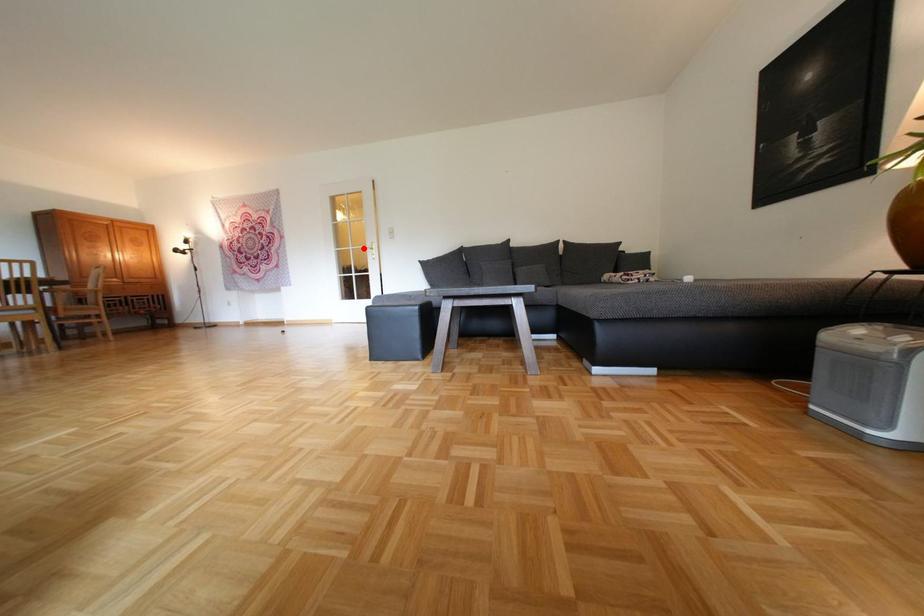
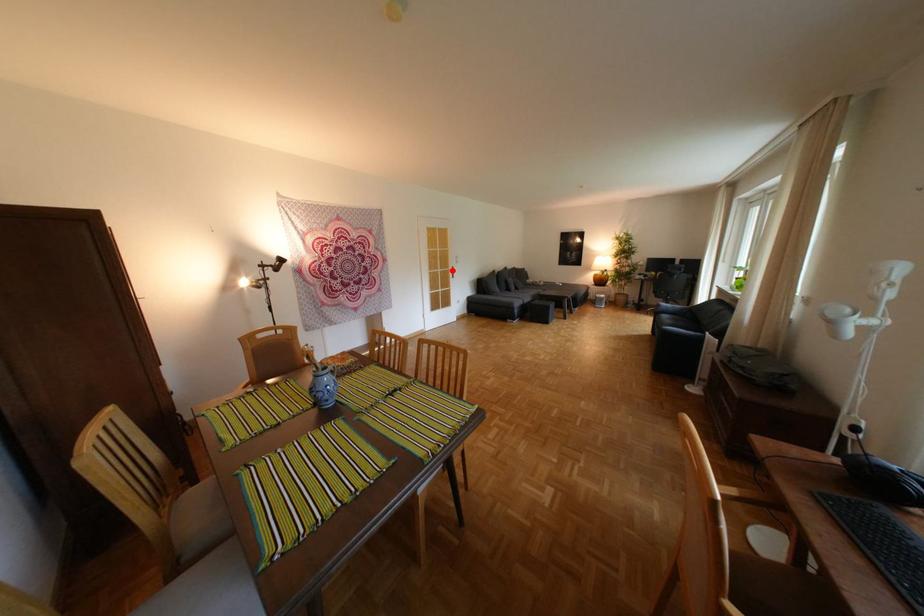
I am providing you with two images of the same scene from different viewpoints. A red point is marked on the first image and another point is marked on the second image. Are the points marked in image1 and image2 representing the same 3D position?

Yes